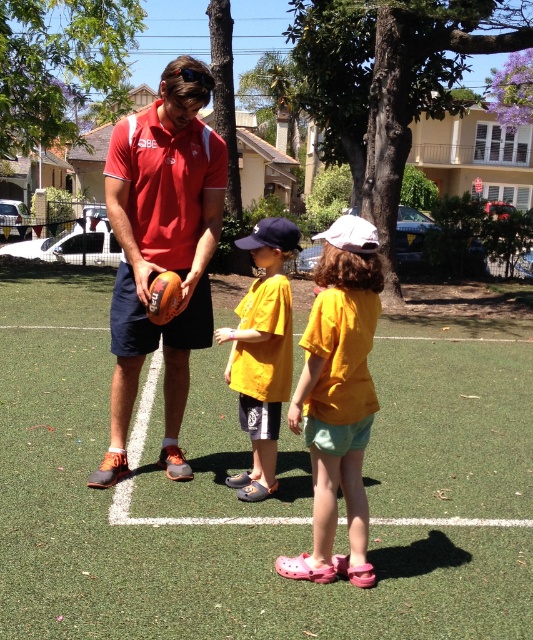
Question: Observing the image, what is the correct spatial positioning of yellow matte shirt at center in reference to yellow cotton shirt at center?

Choices:
 (A) right
 (B) left

Answer: (A)

Question: Is matte red polo shirt at center to the right of yellow matte shirt at center from the viewer's perspective?

Choices:
 (A) no
 (B) yes

Answer: (A)

Question: Among these points, which one is nearest to the camera?

Choices:
 (A) (512, 621)
 (B) (278, 369)
 (C) (205, 164)

Answer: (A)

Question: Which point is farther to the camera?

Choices:
 (A) matte red polo shirt at center
 (B) yellow matte shirt at center
 (C) yellow cotton shirt at center

Answer: (C)

Question: Does green turf football field at center appear on the left side of yellow cotton shirt at center?

Choices:
 (A) yes
 (B) no

Answer: (B)

Question: Which of the following is the closest to the observer?

Choices:
 (A) yellow cotton shirt at center
 (B) green turf football field at center
 (C) matte red polo shirt at center
 (D) yellow matte shirt at center

Answer: (B)